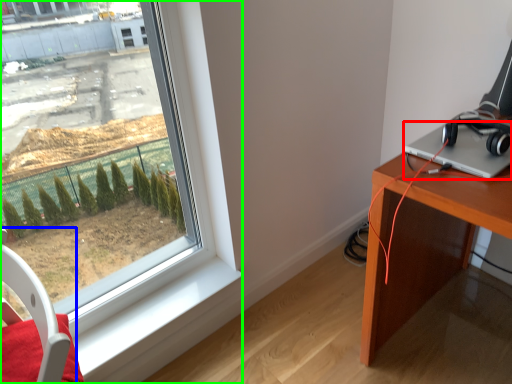
Question: Which object is positioned closest to laptop (highlighted by a red box)? Select from swivel chair (highlighted by a blue box) and window (highlighted by a green box).

Choices:
 (A) swivel chair
 (B) window

Answer: (B)